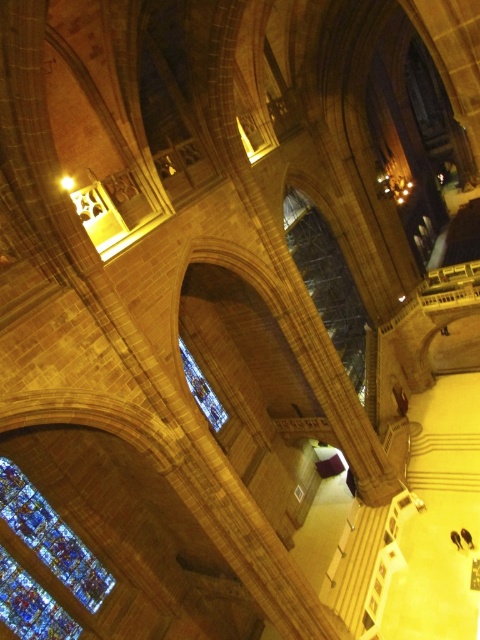
Does point (41, 522) come farther from viewer compared to point (217, 432)?

No.

Is point (97, 598) farther from camera compared to point (192, 371)?

No, (97, 598) is in front of (192, 371).

Find the location of `stained glass window at lower left`. stained glass window at lower left is located at coordinates (51, 538).

Which is below, clear glass window at center or stained glass window at lower left?

stained glass window at lower left is lower down.

Locate an element on the screen. clear glass window at center is located at coordinates (327, 282).

Is the position of clear glass window at center less distant than that of stained glass window at center?

No.

What are the coordinates of `clear glass window at center` in the screenshot? It's located at (327, 282).